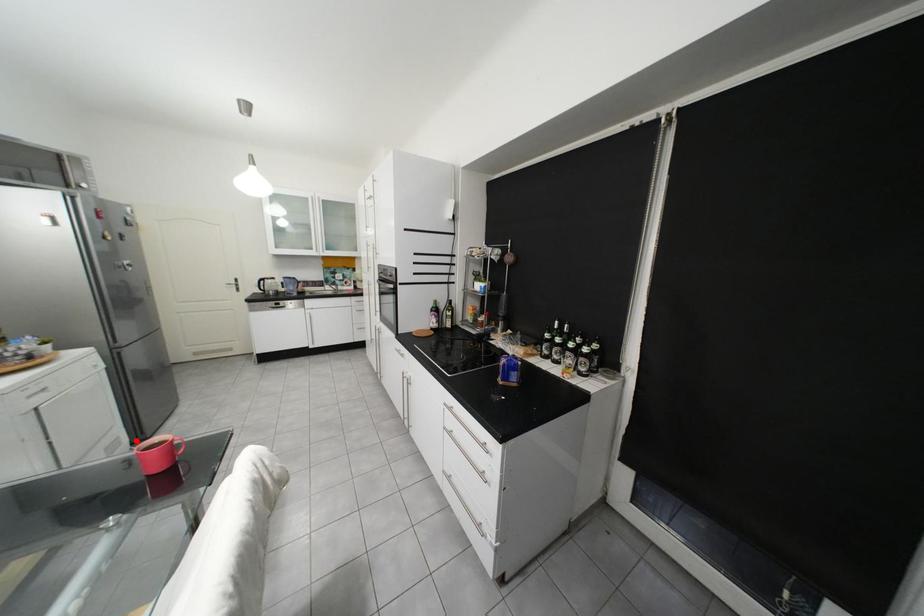
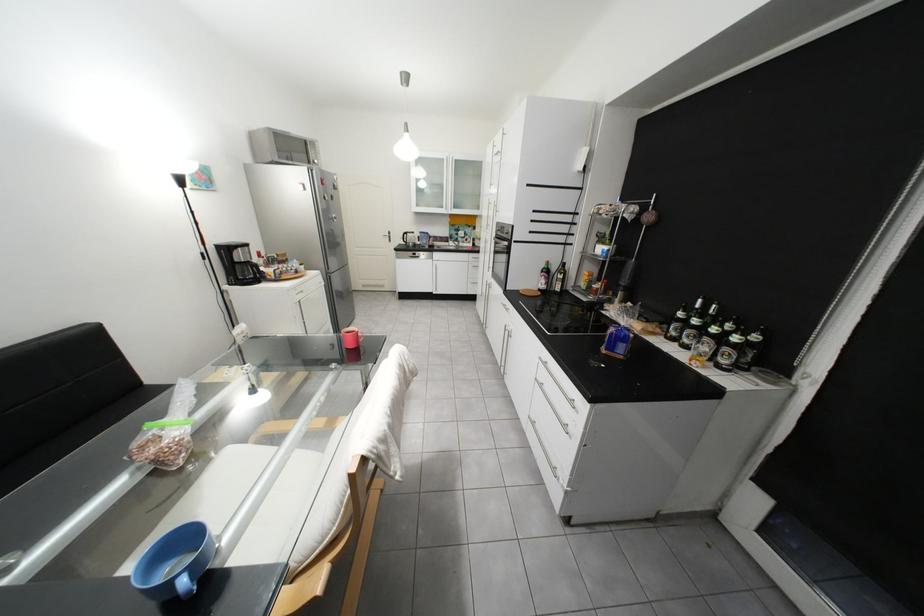
Question: I am providing you with two images of the same scene from different viewpoints. In image1, a red point is highlighted. Considering the same 3D point in image2, which of the following is correct?

Choices:
 (A) It is closer
 (B) It is farther

Answer: (B)